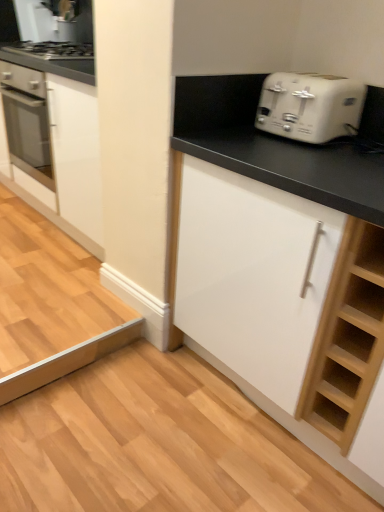
Question: Is white matte cabinet at center, which appears as the 1th cabinetry when viewed from the right, at the right side of white glossy cabinet at left, acting as the 2th cabinetry starting from the right?

Choices:
 (A) no
 (B) yes

Answer: (B)

Question: Considering the relative sizes of white matte cabinet at center, acting as the second cabinetry starting from the back, and white glossy cabinet at left, the 1th cabinetry from the back, in the image provided, is white matte cabinet at center, acting as the second cabinetry starting from the back, wider than white glossy cabinet at left, the 1th cabinetry from the back,?

Choices:
 (A) no
 (B) yes

Answer: (A)

Question: Can you confirm if white matte cabinet at center, which appears as the 1th cabinetry when viewed from the right, is bigger than white glossy cabinet at left, acting as the 2th cabinetry starting from the right?

Choices:
 (A) no
 (B) yes

Answer: (B)

Question: From the image's perspective, would you say white matte cabinet at center, acting as the second cabinetry starting from the back, is shown under white glossy cabinet at left, the 1th cabinetry from the back?

Choices:
 (A) yes
 (B) no

Answer: (A)

Question: From a real-world perspective, does white matte cabinet at center, arranged as the 2th cabinetry when viewed from the left, sit lower than white glossy cabinet at left, the 1th cabinetry from the back?

Choices:
 (A) yes
 (B) no

Answer: (A)

Question: From a real-world perspective, is white matte cabinet at center, arranged as the 2th cabinetry when viewed from the left, located higher than white glossy cabinet at left, which is the first cabinetry from left to right?

Choices:
 (A) yes
 (B) no

Answer: (B)

Question: Are white matte cabinet at center, which appears as the 1th cabinetry when viewed from the right, and white plastic toaster at upper right far apart?

Choices:
 (A) no
 (B) yes

Answer: (A)

Question: Is white matte cabinet at center, acting as the second cabinetry starting from the back, next to white plastic toaster at upper right and touching it?

Choices:
 (A) no
 (B) yes

Answer: (A)

Question: Considering the relative sizes of white matte cabinet at center, which appears as the 1th cabinetry when viewed from the right, and white plastic toaster at upper right in the image provided, is white matte cabinet at center, which appears as the 1th cabinetry when viewed from the right, thinner than white plastic toaster at upper right?

Choices:
 (A) yes
 (B) no

Answer: (B)

Question: Does white matte cabinet at center, acting as the second cabinetry starting from the back, appear on the left side of white plastic toaster at upper right?

Choices:
 (A) no
 (B) yes

Answer: (A)

Question: From the image's perspective, would you say white matte cabinet at center, acting as the second cabinetry starting from the back, is positioned over white plastic toaster at upper right?

Choices:
 (A) yes
 (B) no

Answer: (B)

Question: Is white matte cabinet at center, arranged as the 2th cabinetry when viewed from the left, taller than white plastic toaster at upper right?

Choices:
 (A) no
 (B) yes

Answer: (B)

Question: Can you confirm if white plastic toaster at upper right is positioned to the left of white matte cabinet at center, acting as the second cabinetry starting from the back?

Choices:
 (A) no
 (B) yes

Answer: (B)